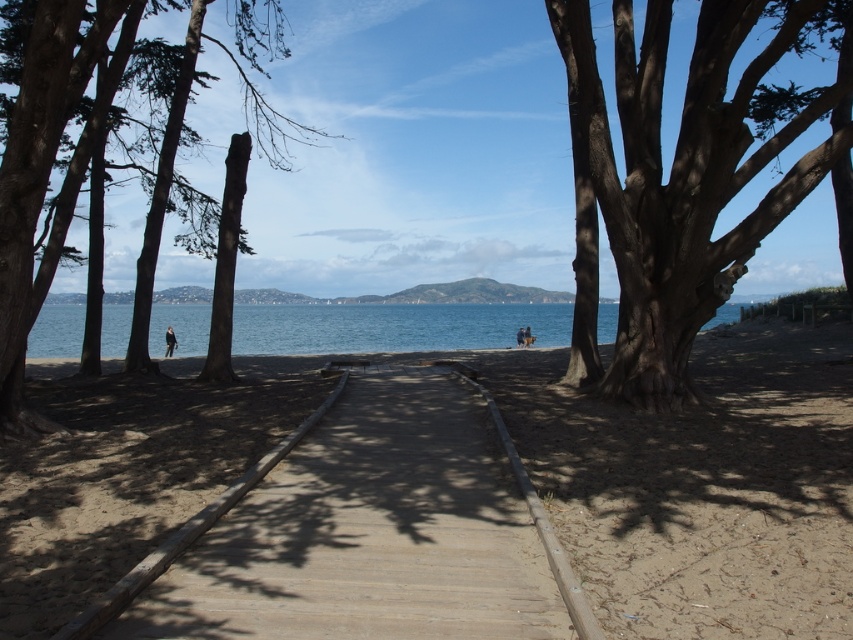
Question: Which of these objects is positioned closest to the smooth brown tree trunk at right?

Choices:
 (A) wooden boardwalk at center
 (B) blue water at center

Answer: (A)

Question: Does wooden boardwalk at center lie behind smooth brown tree trunk at right?

Choices:
 (A) no
 (B) yes

Answer: (A)

Question: Which of the following is the closest to the observer?

Choices:
 (A) smooth brown tree trunk at right
 (B) smooth brown tree trunk at left

Answer: (B)

Question: Does smooth brown tree trunk at right have a lesser width compared to smooth brown tree trunk at left?

Choices:
 (A) yes
 (B) no

Answer: (B)

Question: Considering the relative positions of wooden boardwalk at center and smooth brown tree trunk at right in the image provided, where is wooden boardwalk at center located with respect to smooth brown tree trunk at right?

Choices:
 (A) above
 (B) below

Answer: (B)

Question: Which object is the closest to the smooth brown tree trunk at right?

Choices:
 (A) wooden boardwalk at center
 (B) smooth brown tree trunk at left
 (C) blue water at center

Answer: (A)